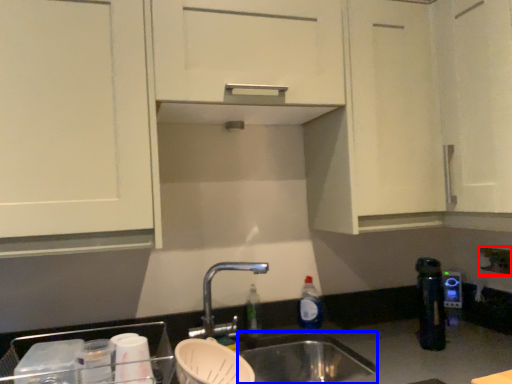
Question: Among these objects, which one is farthest to the camera, electric outlet (highlighted by a red box) or sink (highlighted by a blue box)?

Choices:
 (A) electric outlet
 (B) sink

Answer: (A)